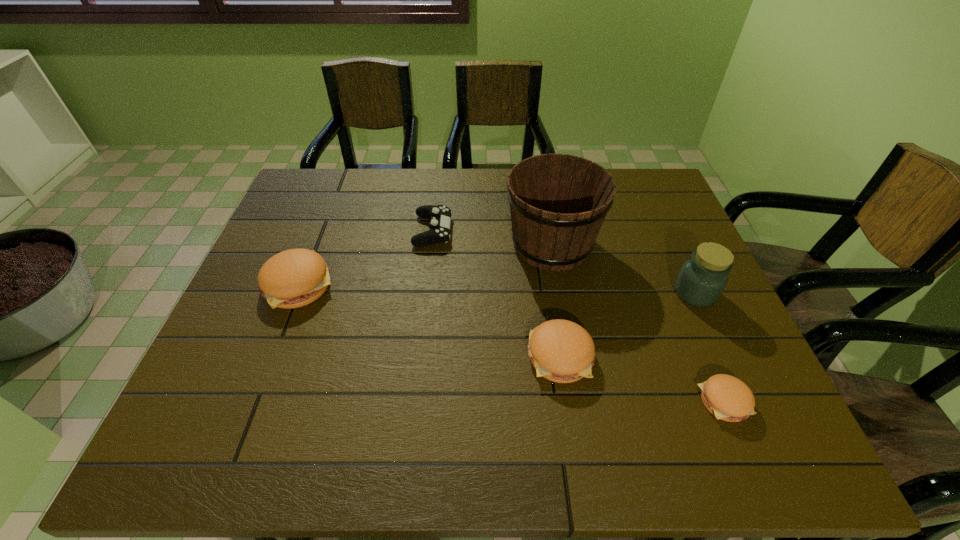
Locate an element on the screen. The height and width of the screenshot is (540, 960). the farthest patty is located at coordinates (294, 278).

Where is `the leftmost patty`? the leftmost patty is located at coordinates (294, 278).

Locate an element on the screen. The width and height of the screenshot is (960, 540). the second tallest patty is located at coordinates (561, 351).

The height and width of the screenshot is (540, 960). Identify the location of the rightmost patty. (728, 398).

Find the location of `the shortest patty`. the shortest patty is located at coordinates (728, 398).

I want to click on wine bucket, so [558, 203].

Identify the location of the fifth tallest object. Image resolution: width=960 pixels, height=540 pixels. (439, 225).

The height and width of the screenshot is (540, 960). I want to click on the second object from left to right, so click(x=439, y=225).

This screenshot has width=960, height=540. Find the location of `the second tallest object`. the second tallest object is located at coordinates (702, 279).

At what (x,y) coordinates should I click in order to perform the action: click on vacant area situated on the right of the leftmost object. Please return your answer as a coordinate pair (x, y). Image resolution: width=960 pixels, height=540 pixels. Looking at the image, I should click on (437, 285).